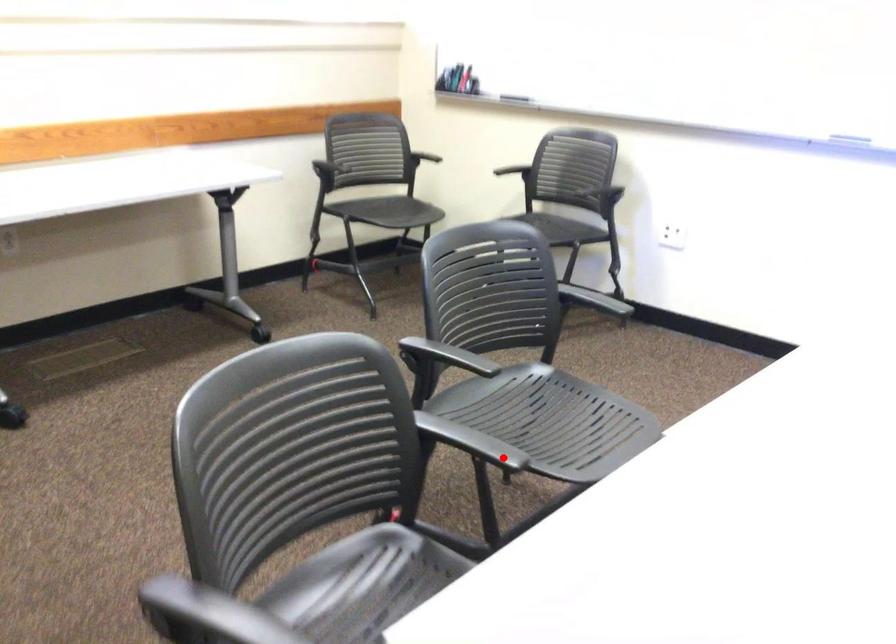
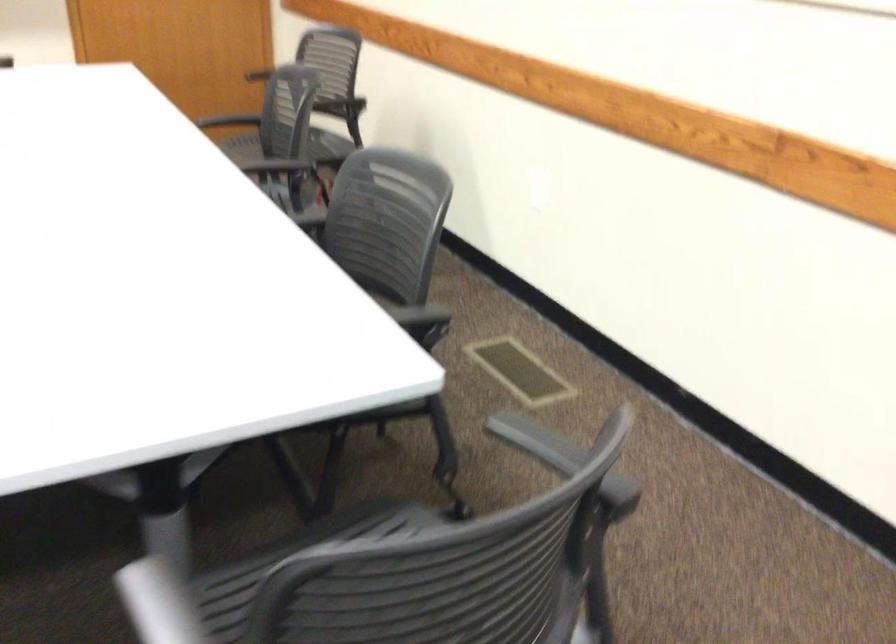
Question: A red point is marked in image1. In image2, is the corresponding 3D point closer to the camera or farther? Reply with the corresponding letter.

Choices:
 (A) The corresponding 3D point is closer.
 (B) The corresponding 3D point is farther.

Answer: (A)